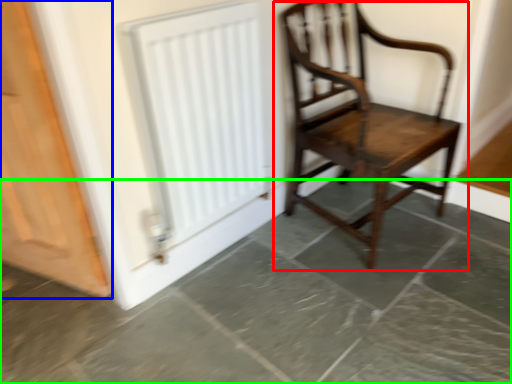
Question: Which is farther away from chair (highlighted by a red box)? door (highlighted by a blue box) or concrete (highlighted by a green box)?

Choices:
 (A) door
 (B) concrete

Answer: (A)